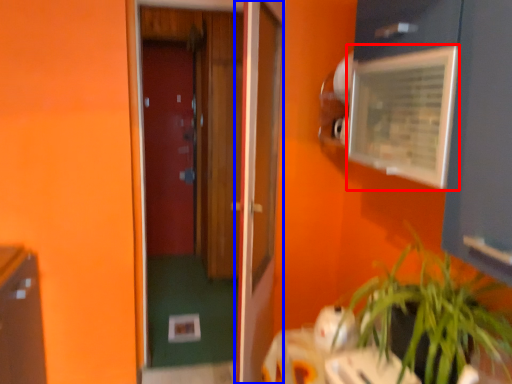
Question: Which of the following is the closest to the observer, medicine cabinet (highlighted by a red box) or door (highlighted by a blue box)?

Choices:
 (A) medicine cabinet
 (B) door

Answer: (A)